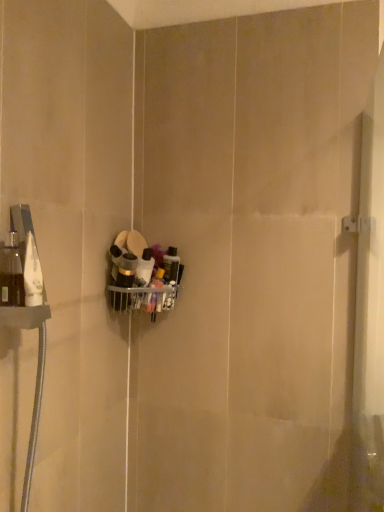
The height and width of the screenshot is (512, 384). Find the location of `translucent plastic bottles at center, the second toiletry when ordered from left to right`. translucent plastic bottles at center, the second toiletry when ordered from left to right is located at coordinates (144, 268).

The width and height of the screenshot is (384, 512). Describe the element at coordinates (144, 268) in the screenshot. I see `translucent plastic bottles at center, the second toiletry when ordered from left to right` at that location.

Find the location of a particular element. matte black container at center, the first toiletry when ordered from left to right is located at coordinates (126, 271).

What is the approximate height of matte black container at center, which ranks as the 2th toiletry in right-to-left order?

The height of matte black container at center, which ranks as the 2th toiletry in right-to-left order, is 6.89 inches.

How much space does matte black container at center, the first toiletry when ordered from left to right, occupy horizontally?

The width of matte black container at center, the first toiletry when ordered from left to right, is 2.61 inches.

This screenshot has width=384, height=512. What do you see at coordinates (126, 271) in the screenshot?
I see `matte black container at center, which ranks as the 2th toiletry in right-to-left order` at bounding box center [126, 271].

Where is `translucent plastic bottles at center, the second toiletry when ordered from left to right`? This screenshot has width=384, height=512. translucent plastic bottles at center, the second toiletry when ordered from left to right is located at coordinates (144, 268).

Is matte black container at center, the first toiletry when ordered from left to right, to the left or to the right of translucent plastic bottles at center, acting as the 1th toiletry starting from the right, in the image?

Clearly, matte black container at center, the first toiletry when ordered from left to right, is on the left of translucent plastic bottles at center, acting as the 1th toiletry starting from the right, in the image.

Is matte black container at center, which ranks as the 2th toiletry in right-to-left order, positioned before translucent plastic bottles at center, acting as the 1th toiletry starting from the right?

Yes, matte black container at center, which ranks as the 2th toiletry in right-to-left order, is closer to the camera.

Between point (121, 275) and point (136, 277), which one is positioned behind?

The point (136, 277) is behind.

From the image's perspective, does matte black container at center, the first toiletry when ordered from left to right, appear lower than translucent plastic bottles at center, acting as the 1th toiletry starting from the right?

No, from the image's perspective, matte black container at center, the first toiletry when ordered from left to right, is not beneath translucent plastic bottles at center, acting as the 1th toiletry starting from the right.

From a real-world perspective, which is physically above, matte black container at center, the first toiletry when ordered from left to right, or translucent plastic bottles at center, the second toiletry when ordered from left to right?

matte black container at center, the first toiletry when ordered from left to right.

Considering the sizes of objects matte black container at center, the first toiletry when ordered from left to right, and translucent plastic bottles at center, the second toiletry when ordered from left to right, in the image provided, who is wider, matte black container at center, the first toiletry when ordered from left to right, or translucent plastic bottles at center, the second toiletry when ordered from left to right,?

Wider between the two is matte black container at center, the first toiletry when ordered from left to right.

Between matte black container at center, which ranks as the 2th toiletry in right-to-left order, and translucent plastic bottles at center, the second toiletry when ordered from left to right, which one has more height?

Standing taller between the two is matte black container at center, which ranks as the 2th toiletry in right-to-left order.

Between matte black container at center, the first toiletry when ordered from left to right, and translucent plastic bottles at center, acting as the 1th toiletry starting from the right, which one has larger size?

matte black container at center, the first toiletry when ordered from left to right.

Is matte black container at center, which ranks as the 2th toiletry in right-to-left order, spatially inside translucent plastic bottles at center, acting as the 1th toiletry starting from the right, or outside of it?

matte black container at center, which ranks as the 2th toiletry in right-to-left order, is located beyond the bounds of translucent plastic bottles at center, acting as the 1th toiletry starting from the right.

Is matte black container at center, the first toiletry when ordered from left to right, directly adjacent to translucent plastic bottles at center, acting as the 1th toiletry starting from the right?

Yes, matte black container at center, the first toiletry when ordered from left to right, and translucent plastic bottles at center, acting as the 1th toiletry starting from the right, clearly make contact.

Is matte black container at center, the first toiletry when ordered from left to right, oriented towards translucent plastic bottles at center, the second toiletry when ordered from left to right?

No, matte black container at center, the first toiletry when ordered from left to right, is not aimed at translucent plastic bottles at center, the second toiletry when ordered from left to right.

How many degrees apart are the facing directions of matte black container at center, the first toiletry when ordered from left to right, and translucent plastic bottles at center, the second toiletry when ordered from left to right?

There is a 26.3-degree angle between the facing directions of matte black container at center, the first toiletry when ordered from left to right, and translucent plastic bottles at center, the second toiletry when ordered from left to right.

In order to click on toiletry above the translucent plastic bottles at center, the second toiletry when ordered from left to right (from a real-world perspective) in this screenshot , I will do `click(126, 271)`.

Would you say translucent plastic bottles at center, acting as the 1th toiletry starting from the right, is to the left or to the right of matte black container at center, the first toiletry when ordered from left to right, in the picture?

In the image, translucent plastic bottles at center, acting as the 1th toiletry starting from the right, appears on the right side of matte black container at center, the first toiletry when ordered from left to right.

Does translucent plastic bottles at center, the second toiletry when ordered from left to right, come behind matte black container at center, the first toiletry when ordered from left to right?

Yes, translucent plastic bottles at center, the second toiletry when ordered from left to right, is further from the viewer.

Does point (145, 277) lie behind point (130, 269)?

Yes, it is behind point (130, 269).

From the image's perspective, which one is positioned lower, translucent plastic bottles at center, acting as the 1th toiletry starting from the right, or matte black container at center, the first toiletry when ordered from left to right?

From the image's view, translucent plastic bottles at center, acting as the 1th toiletry starting from the right, is below.

From a real-world perspective, is translucent plastic bottles at center, acting as the 1th toiletry starting from the right, over matte black container at center, the first toiletry when ordered from left to right?

Incorrect, from a real-world perspective, translucent plastic bottles at center, acting as the 1th toiletry starting from the right, is lower than matte black container at center, the first toiletry when ordered from left to right.

Does translucent plastic bottles at center, the second toiletry when ordered from left to right, have a greater width compared to matte black container at center, which ranks as the 2th toiletry in right-to-left order?

Incorrect, the width of translucent plastic bottles at center, the second toiletry when ordered from left to right, does not surpass that of matte black container at center, which ranks as the 2th toiletry in right-to-left order.

Is translucent plastic bottles at center, the second toiletry when ordered from left to right, taller than matte black container at center, which ranks as the 2th toiletry in right-to-left order?

No.

Is translucent plastic bottles at center, the second toiletry when ordered from left to right, smaller than matte black container at center, which ranks as the 2th toiletry in right-to-left order?

Indeed, translucent plastic bottles at center, the second toiletry when ordered from left to right, has a smaller size compared to matte black container at center, which ranks as the 2th toiletry in right-to-left order.

Could matte black container at center, the first toiletry when ordered from left to right, be considered to be inside translucent plastic bottles at center, acting as the 1th toiletry starting from the right?

Actually, matte black container at center, the first toiletry when ordered from left to right, is outside translucent plastic bottles at center, acting as the 1th toiletry starting from the right.

Are translucent plastic bottles at center, acting as the 1th toiletry starting from the right, and matte black container at center, which ranks as the 2th toiletry in right-to-left order, beside each other?

Yes, the surface of translucent plastic bottles at center, acting as the 1th toiletry starting from the right, is in contact with matte black container at center, which ranks as the 2th toiletry in right-to-left order.

Is translucent plastic bottles at center, acting as the 1th toiletry starting from the right, aimed at matte black container at center, which ranks as the 2th toiletry in right-to-left order?

No, translucent plastic bottles at center, acting as the 1th toiletry starting from the right, is not turned towards matte black container at center, which ranks as the 2th toiletry in right-to-left order.

Can you tell me how much translucent plastic bottles at center, the second toiletry when ordered from left to right, and matte black container at center, which ranks as the 2th toiletry in right-to-left order, differ in facing direction?

There is a 26.3-degree angle between the facing directions of translucent plastic bottles at center, the second toiletry when ordered from left to right, and matte black container at center, which ranks as the 2th toiletry in right-to-left order.

Identify the location of toiletry located in front of the translucent plastic bottles at center, acting as the 1th toiletry starting from the right. This screenshot has height=512, width=384. (126, 271).

Where is `toiletry in front of the translucent plastic bottles at center, acting as the 1th toiletry starting from the right`? Image resolution: width=384 pixels, height=512 pixels. toiletry in front of the translucent plastic bottles at center, acting as the 1th toiletry starting from the right is located at coordinates (126, 271).

Find the location of a particular element. This screenshot has width=384, height=512. toiletry behind the matte black container at center, which ranks as the 2th toiletry in right-to-left order is located at coordinates (144, 268).